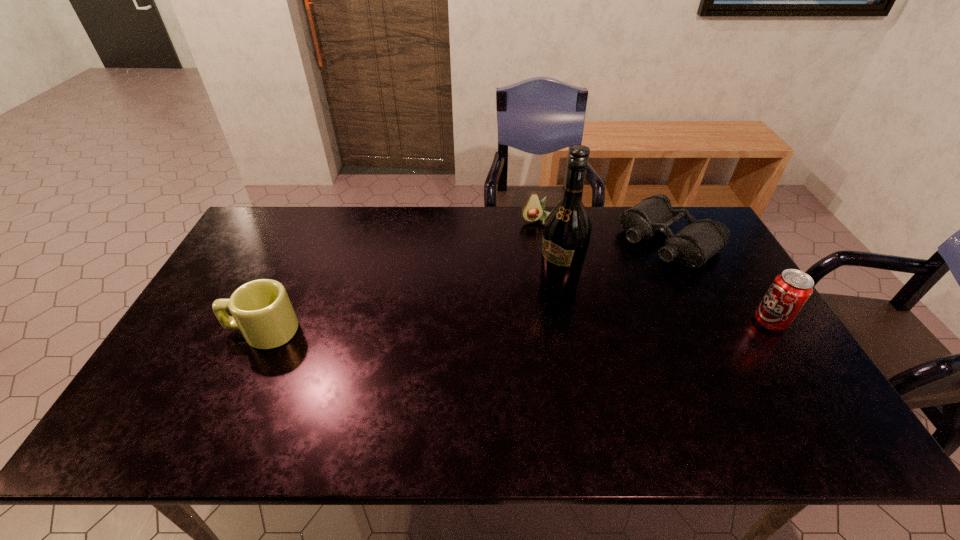
Identify the location of soda at the right edge. (790, 290).

Identify the location of binoculars that is at the right edge. (700, 240).

Image resolution: width=960 pixels, height=540 pixels. In order to click on object located in the far right corner section of the desktop in this screenshot , I will do `click(700, 240)`.

This screenshot has height=540, width=960. In order to click on vacant space at the far edge of the desktop in this screenshot , I will do `click(464, 211)`.

You are a GUI agent. You are given a task and a screenshot of the screen. Output one action in this format:
    pyautogui.click(x=<x>, y=<y>)
    Task: Click on the blank space at the near edge of the desktop
    
    Given the screenshot: What is the action you would take?
    pyautogui.click(x=460, y=376)

This screenshot has width=960, height=540. I want to click on vacant space at the left edge of the desktop, so click(x=192, y=322).

You are a GUI agent. You are given a task and a screenshot of the screen. Output one action in this format:
    pyautogui.click(x=<x>, y=<y>)
    Task: Click on the free space at the right edge of the desktop
    
    Given the screenshot: What is the action you would take?
    tap(752, 359)

The image size is (960, 540). In order to click on vacant space that's between the soda and the mug in this screenshot , I will do `click(516, 327)`.

Identify the location of vacant area that lies between the leftmost object and the avocado. The image size is (960, 540). (399, 276).

You are a GUI agent. You are given a task and a screenshot of the screen. Output one action in this format:
    pyautogui.click(x=<x>, y=<y>)
    Task: Click on the unoccupied position between the shortest object and the avocado
    The width and height of the screenshot is (960, 540).
    Given the screenshot: What is the action you would take?
    click(603, 231)